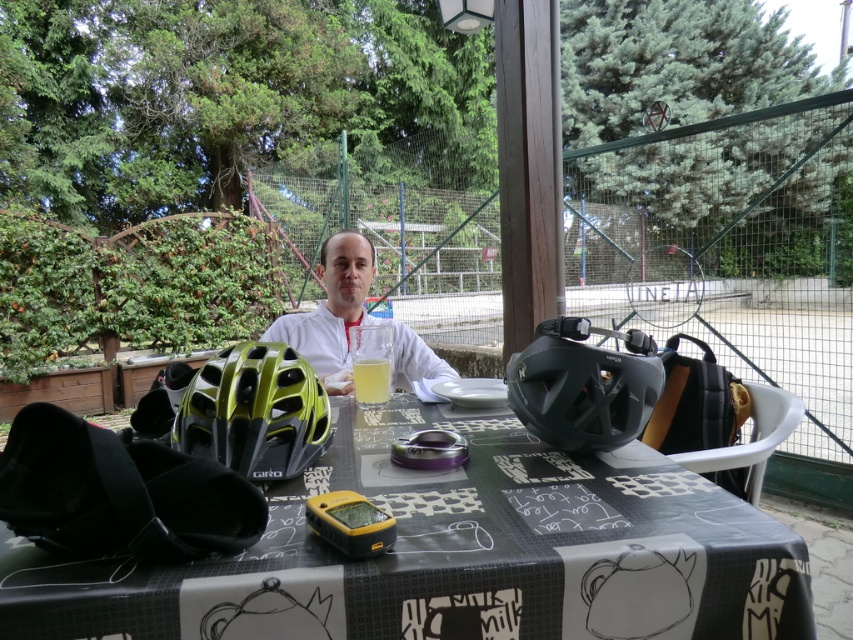
Measure the distance between white matte shirt at center and camera.

The distance of white matte shirt at center from camera is 4.70 feet.

Does white matte shirt at center have a greater height compared to translucent glass at center?

Correct, white matte shirt at center is much taller as translucent glass at center.

Is point (334, 243) farther from camera compared to point (387, 387)?

Yes, it is behind point (387, 387).

Find the location of `white matte shirt at center`. white matte shirt at center is located at coordinates (351, 317).

Does black matte table at center appear over translucent glass at center?

No.

Is point (621, 627) positioned in front of point (364, 397)?

Yes.

Identify the location of black matte table at center. This screenshot has width=853, height=640. (453, 554).

Which is more to the left, black matte table at center or yellow-green matte bicycle helmet at lower left?

Positioned to the left is yellow-green matte bicycle helmet at lower left.

Who is taller, black matte table at center or yellow-green matte bicycle helmet at lower left?

black matte table at center

Which is in front, point (409, 545) or point (276, 403)?

Point (409, 545) is more forward.

You are a GUI agent. You are given a task and a screenshot of the screen. Output one action in this format:
    pyautogui.click(x=<x>, y=<y>)
    Task: Click on the black matte table at center
    The height and width of the screenshot is (640, 853).
    Given the screenshot: What is the action you would take?
    pyautogui.click(x=453, y=554)